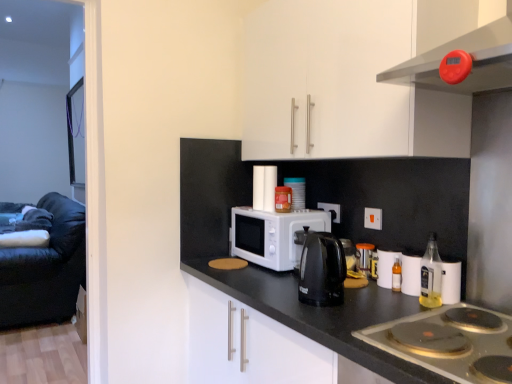
Question: Are white plastic electric outlet at center, the 1th electric outlet viewed from the back, and translucent glass bottle at right located far from each other?

Choices:
 (A) yes
 (B) no

Answer: (B)

Question: Is the depth of white plastic electric outlet at center, the 1th electric outlet viewed from the back, greater than that of translucent glass bottle at right?

Choices:
 (A) no
 (B) yes

Answer: (B)

Question: Considering the relative sizes of white plastic electric outlet at center, arranged as the 2th electric outlet when viewed from the right, and translucent glass bottle at right in the image provided, is white plastic electric outlet at center, arranged as the 2th electric outlet when viewed from the right, thinner than translucent glass bottle at right?

Choices:
 (A) no
 (B) yes

Answer: (B)

Question: From the image's perspective, does white plastic electric outlet at center, positioned as the first electric outlet in left-to-right order, appear higher than translucent glass bottle at right?

Choices:
 (A) no
 (B) yes

Answer: (B)

Question: Considering the relative positions of white plastic electric outlet at center, positioned as the first electric outlet in left-to-right order, and translucent glass bottle at right in the image provided, is white plastic electric outlet at center, positioned as the first electric outlet in left-to-right order, in front of translucent glass bottle at right?

Choices:
 (A) no
 (B) yes

Answer: (A)

Question: From a real-world perspective, is black granite countertop at center positioned above or below translucent glass bottle at right?

Choices:
 (A) above
 (B) below

Answer: (B)

Question: Considering their positions, is black granite countertop at center located in front of or behind translucent glass bottle at right?

Choices:
 (A) behind
 (B) front

Answer: (B)

Question: From the image's perspective, relative to translucent glass bottle at right, is black granite countertop at center above or below?

Choices:
 (A) below
 (B) above

Answer: (A)

Question: Based on their sizes in the image, would you say black granite countertop at center is bigger or smaller than translucent glass bottle at right?

Choices:
 (A) big
 (B) small

Answer: (A)

Question: Is silver metallic gas stove at lower right spatially inside translucent plastic bottle at lower right, marked as the second appliance in a back-to-front arrangement, or outside of it?

Choices:
 (A) inside
 (B) outside

Answer: (B)

Question: Is silver metallic gas stove at lower right bigger or smaller than translucent plastic bottle at lower right, the 1th appliance from the bottom?

Choices:
 (A) small
 (B) big

Answer: (B)

Question: In terms of width, does silver metallic gas stove at lower right look wider or thinner when compared to translucent plastic bottle at lower right, the second appliance from the top?

Choices:
 (A) wide
 (B) thin

Answer: (A)

Question: From a real-world perspective, is silver metallic gas stove at lower right above or below translucent plastic bottle at lower right, the 1th appliance from the bottom?

Choices:
 (A) above
 (B) below

Answer: (B)

Question: In the image, is white glossy cabinet at upper center positioned in front of or behind translucent glass bottle at right?

Choices:
 (A) front
 (B) behind

Answer: (A)

Question: From the image's perspective, is white glossy cabinet at upper center positioned above or below translucent glass bottle at right?

Choices:
 (A) above
 (B) below

Answer: (A)